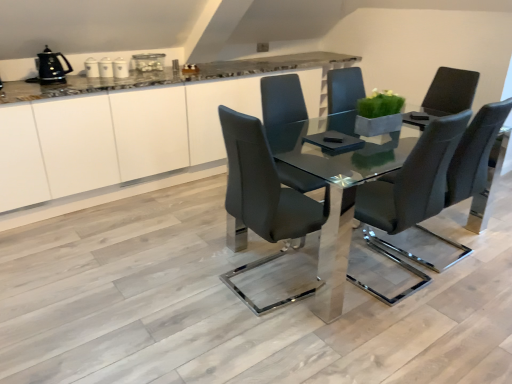
Question: In the image, is matte black chair at center, which ranks as the 2th chair in right-to-left order, on the left side or the right side of clear glass table at center?

Choices:
 (A) left
 (B) right

Answer: (A)

Question: Is matte black chair at center, which ranks as the 2th chair in right-to-left order, inside the boundaries of clear glass table at center, or outside?

Choices:
 (A) inside
 (B) outside

Answer: (A)

Question: Which object is positioned farthest from the matte white vase at upper center, which ranks as the 5th appliance in left-to-right order?

Choices:
 (A) white glossy cabinetry at center
 (B) matte black chair at center, acting as the second chair starting from the left
 (C) green matte planter at center
 (D) matte black chair at center, arranged as the first chair when viewed from the left
 (E) white glossy canister at upper center, placed as the 3th appliance when sorted from right to left

Answer: (B)

Question: Which object is positioned farthest from the white glossy canisters at upper center, which is the second appliance from right to left?

Choices:
 (A) white glossy cabinetry at center
 (B) matte black chair at center, arranged as the first chair when viewed from the left
 (C) matte black chair at center, acting as the second chair starting from the left
 (D) black plastic kettle at upper left, the first appliance when ordered from left to right
 (E) white glossy canister at upper left, positioned as the fourth appliance in right-to-left order

Answer: (C)